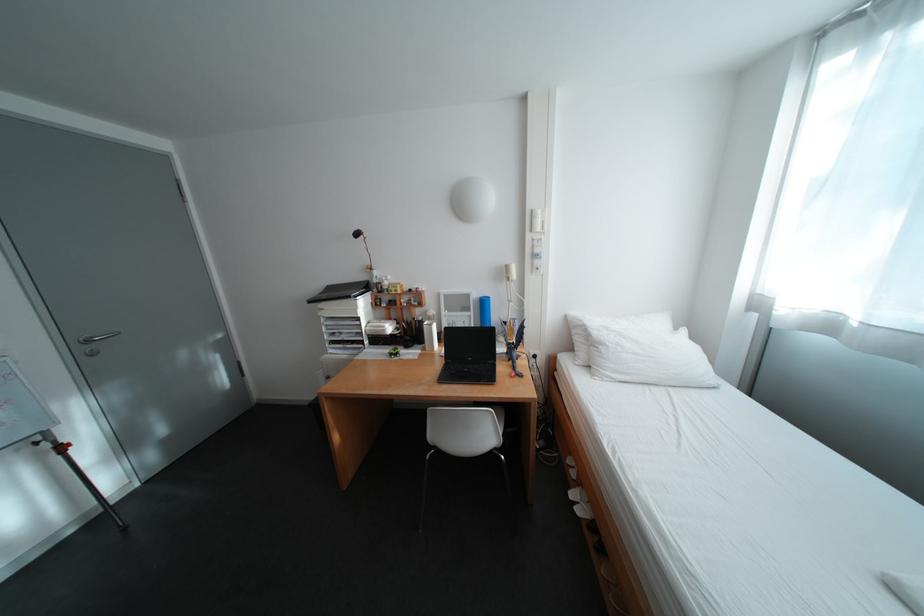
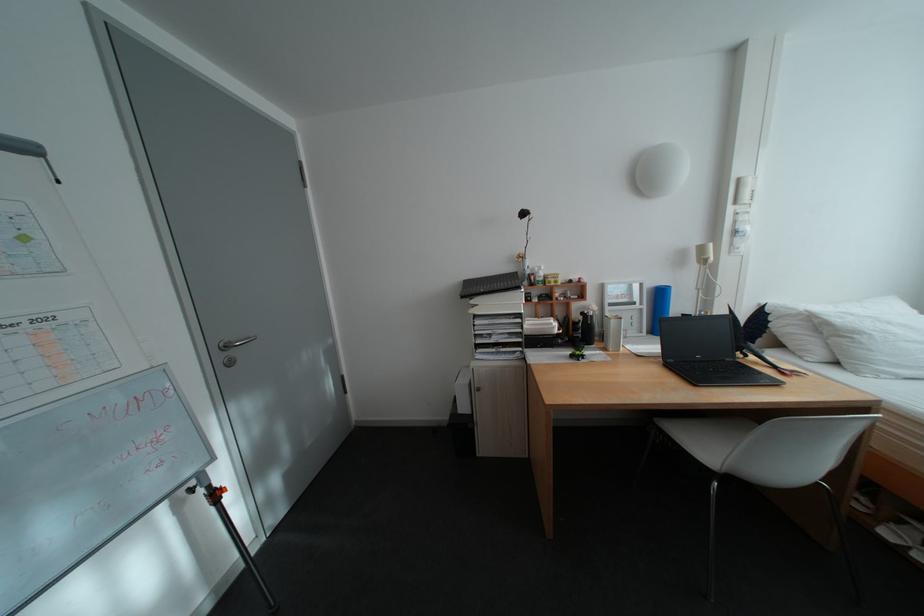
Question: Which direction would the cameraman need to move to produce the second image? Reply with the corresponding letter.

Choices:
 (A) Left
 (B) Right
 (C) Forward
 (D) Backward

Answer: (A)